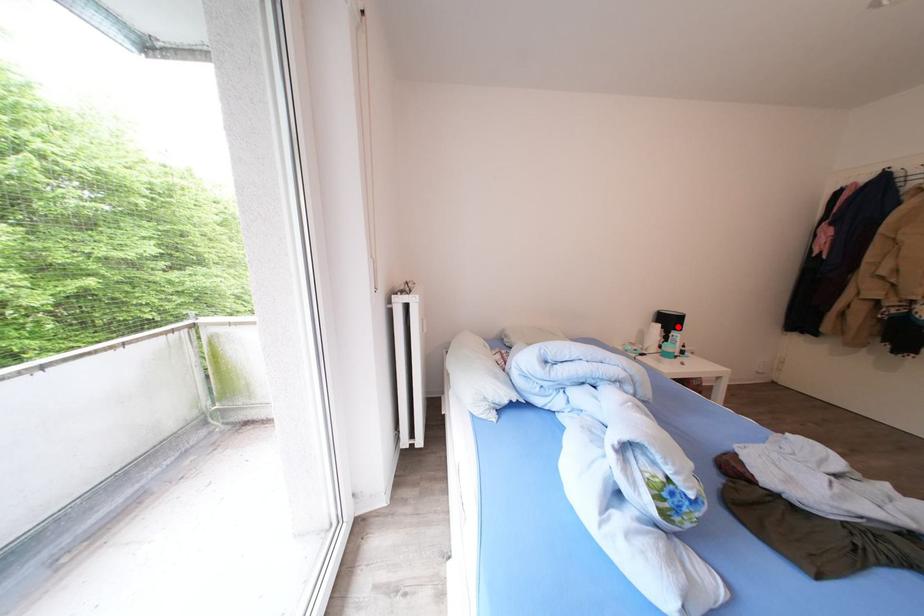
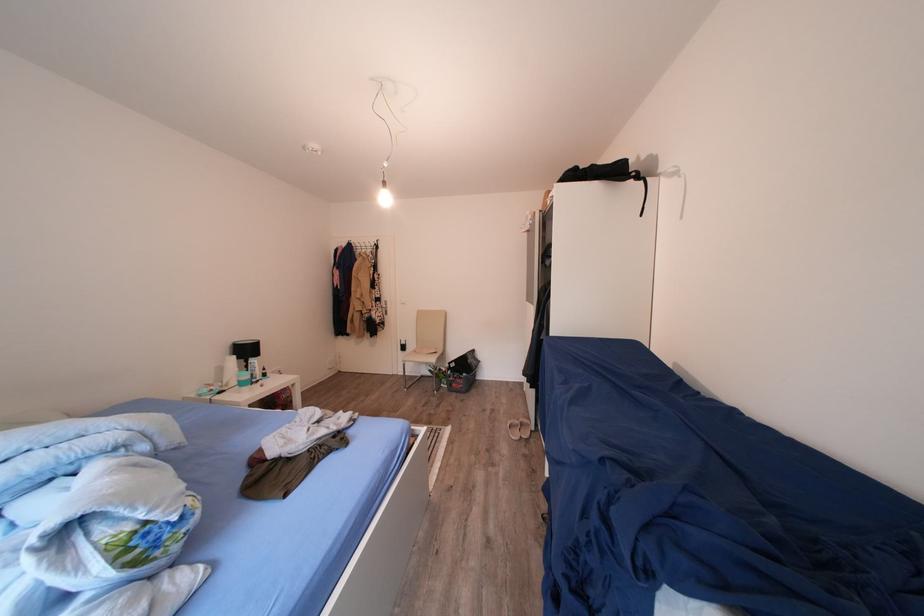
Question: I am providing you with two images of the same scene from different viewpoints. A red point is shown in image1. For the corresponding object point in image2, is it positioned nearer or farther from the camera?

Choices:
 (A) Nearer
 (B) Farther

Answer: (A)